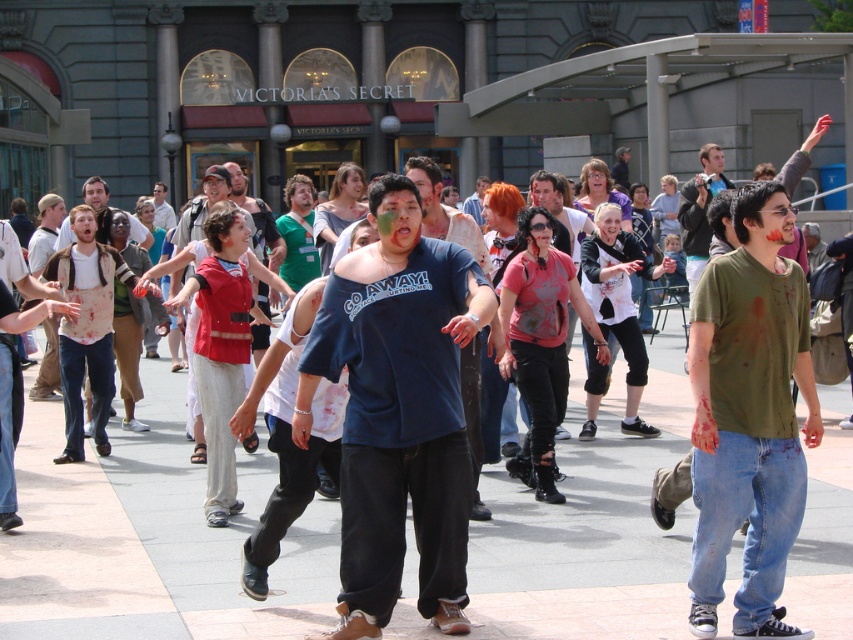
Question: Which of the following is the closest to the observer?

Choices:
 (A) (840, 484)
 (B) (183, 212)
 (C) (450, 561)

Answer: (C)

Question: Can you confirm if gray concrete pavement at center is wider than red fabric vest at center?

Choices:
 (A) yes
 (B) no

Answer: (A)

Question: Is gray concrete pavement at center to the right of matte red shirt at center from the viewer's perspective?

Choices:
 (A) yes
 (B) no

Answer: (B)

Question: Does green matte shirt at center have a lesser width compared to red fabric vest at center?

Choices:
 (A) no
 (B) yes

Answer: (B)

Question: Which point is closer to the camera taking this photo?

Choices:
 (A) (535, 193)
 (B) (782, 321)
 (C) (438, 547)
 (D) (425, 212)

Answer: (B)

Question: Among these points, which one is nearest to the camera?

Choices:
 (A) (416, 522)
 (B) (573, 243)
 (C) (575, 588)

Answer: (A)